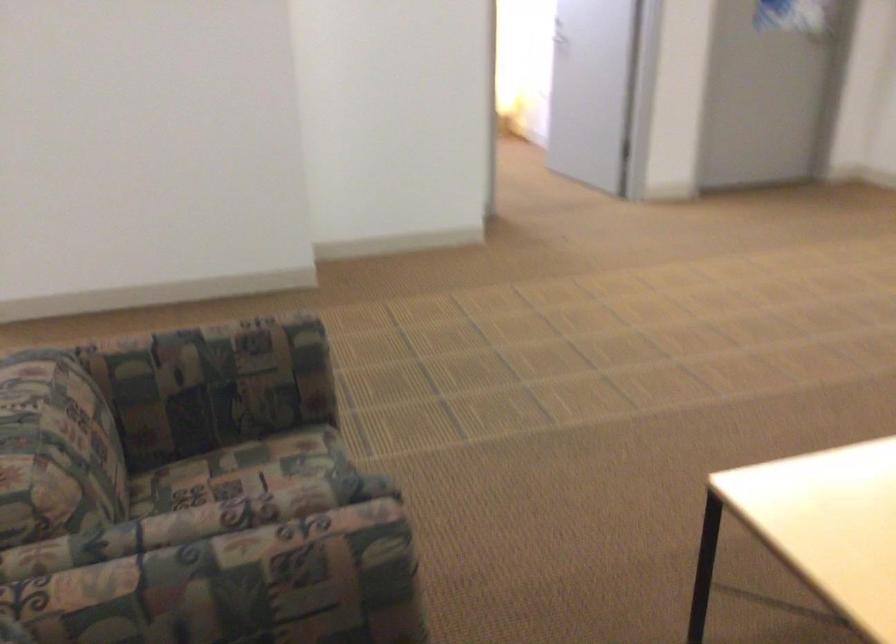
In order to click on patterned sofa armrest in this screenshot , I will do `click(218, 351)`.